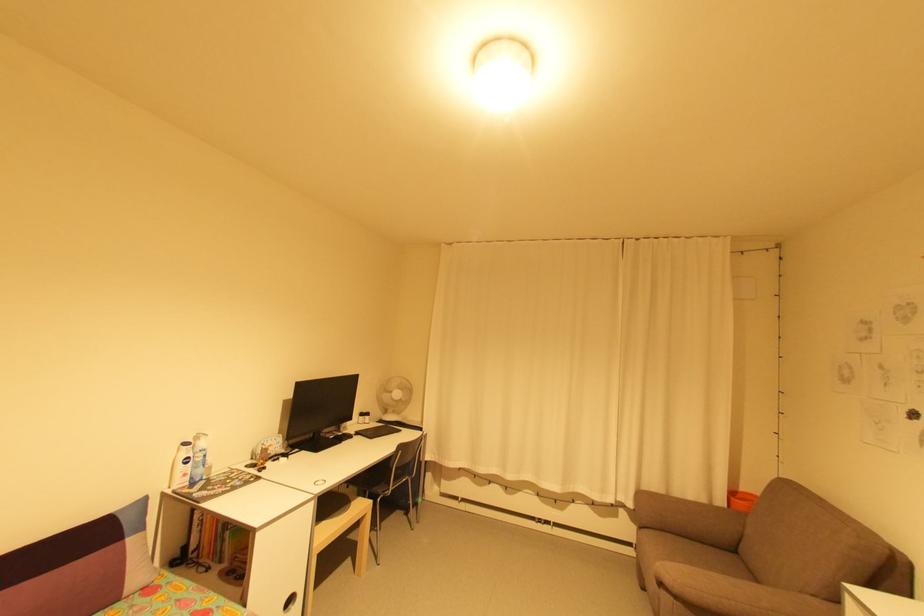
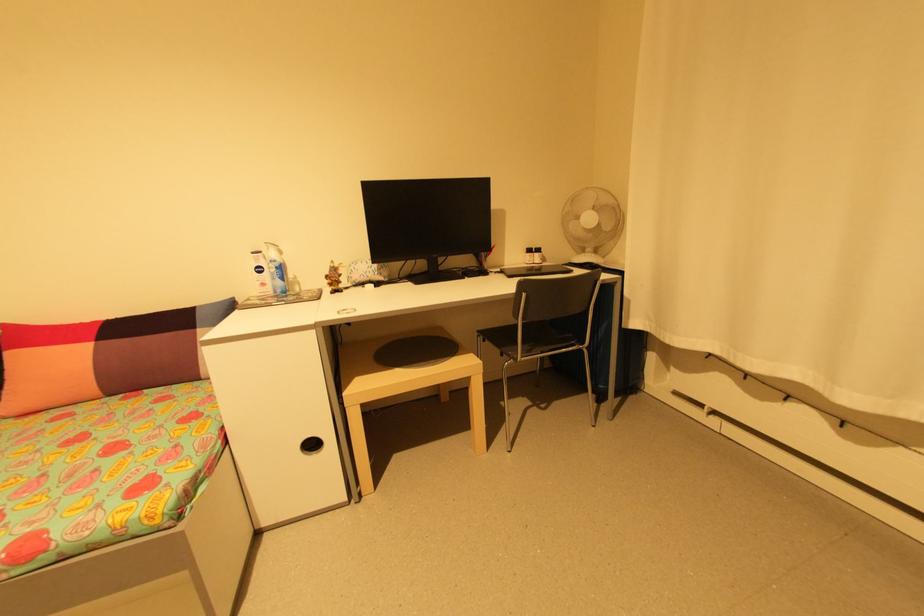
The point at [411,480] is marked in the first image. Where is the corresponding point in the second image?

(585, 352)